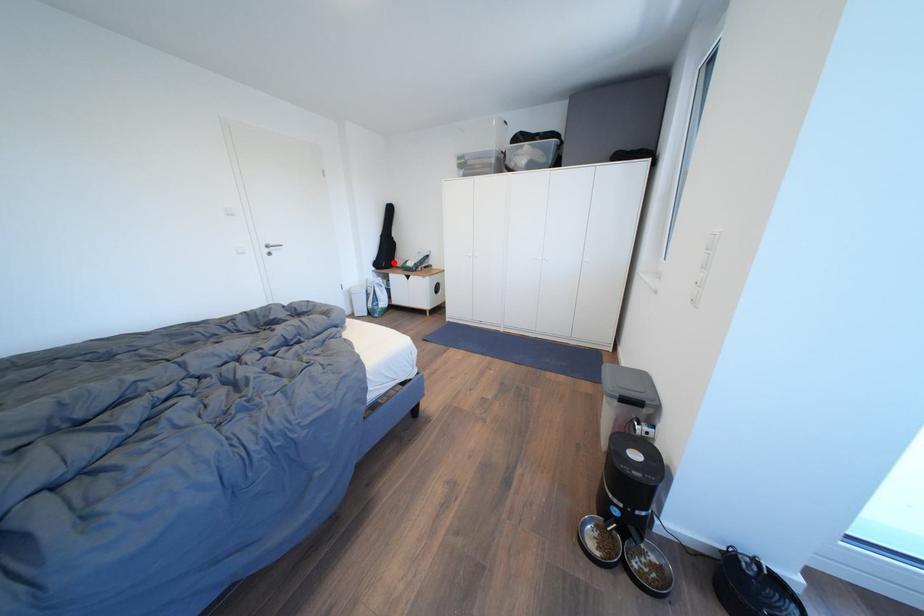
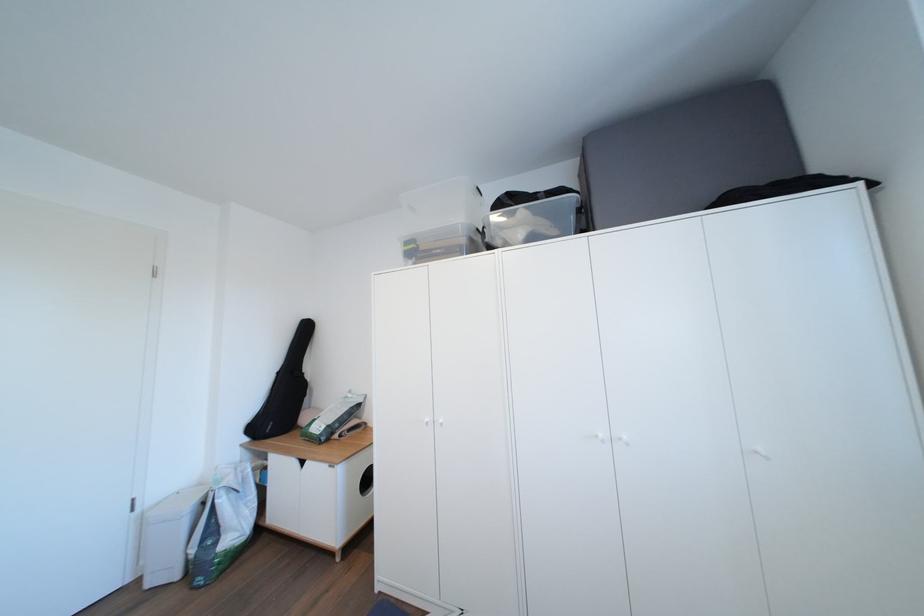
Question: I am providing you with two images of the same scene from different viewpoints. In image1, a red point is highlighted. Considering the same 3D point in image2, which of the following is correct?

Choices:
 (A) It is closer
 (B) It is farther

Answer: (B)